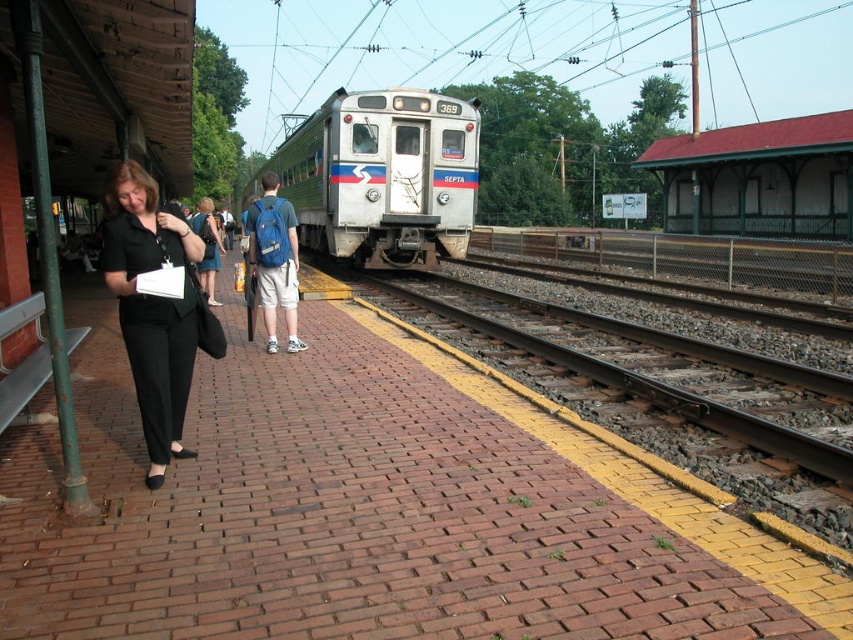
Does smooth metal train track at center have a greater width compared to blue backpack at center?

Indeed, smooth metal train track at center has a greater width compared to blue backpack at center.

Which of these two, smooth metal train track at center or blue backpack at center, stands taller?

smooth metal train track at center is taller.

Locate an element on the screen. This screenshot has height=640, width=853. smooth metal train track at center is located at coordinates (653, 390).

Find the location of a particular element. smooth metal train track at center is located at coordinates (653, 390).

Between blue backpack at center and denim shorts at center, which one is positioned lower?

blue backpack at center

The height and width of the screenshot is (640, 853). I want to click on blue backpack at center, so click(x=276, y=260).

Between point (433, 193) and point (747, 435), which one is positioned in front?

Point (747, 435)

Between point (405, 208) and point (486, 330), which one is positioned in front?

Point (486, 330) is more forward.

Where is `silver metallic train at center`? The height and width of the screenshot is (640, 853). silver metallic train at center is located at coordinates (383, 176).